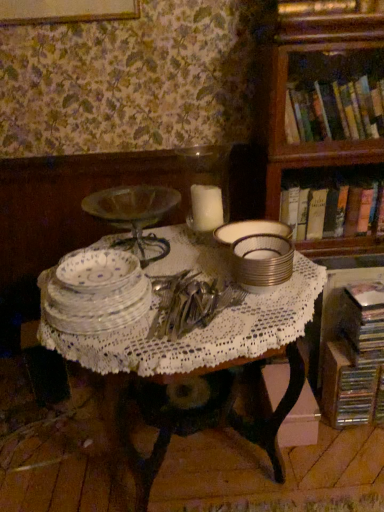
The width and height of the screenshot is (384, 512). Find the location of `free point below porcelain plate at center (from a real-world perspective)`. free point below porcelain plate at center (from a real-world perspective) is located at coordinates point(102,272).